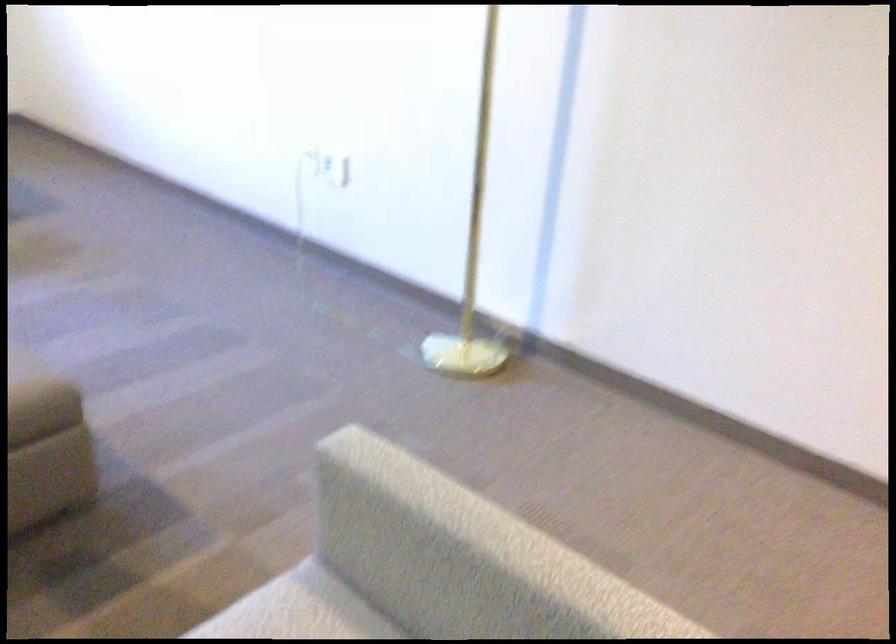
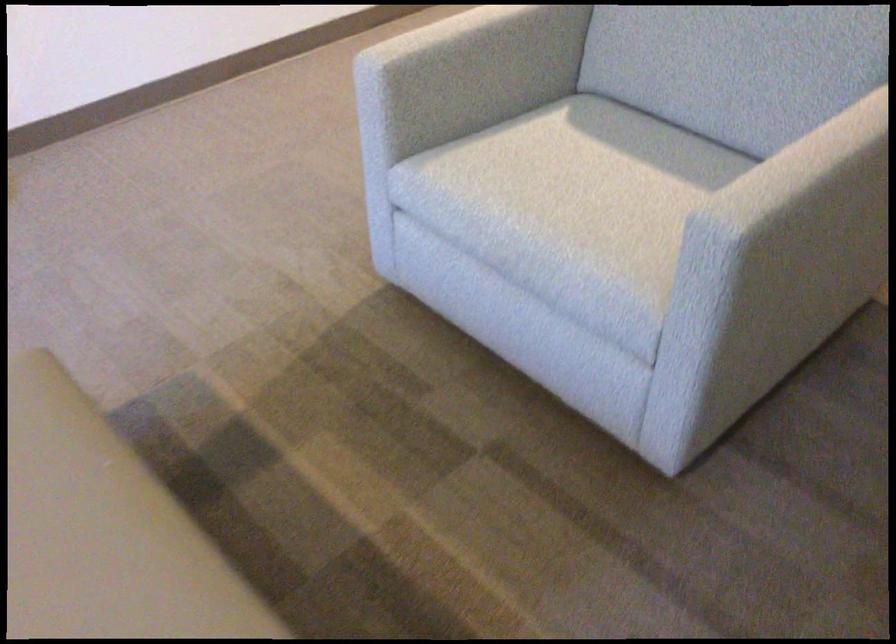
Where in the second image is the point corresponding to (319,518) from the first image?

(385, 120)